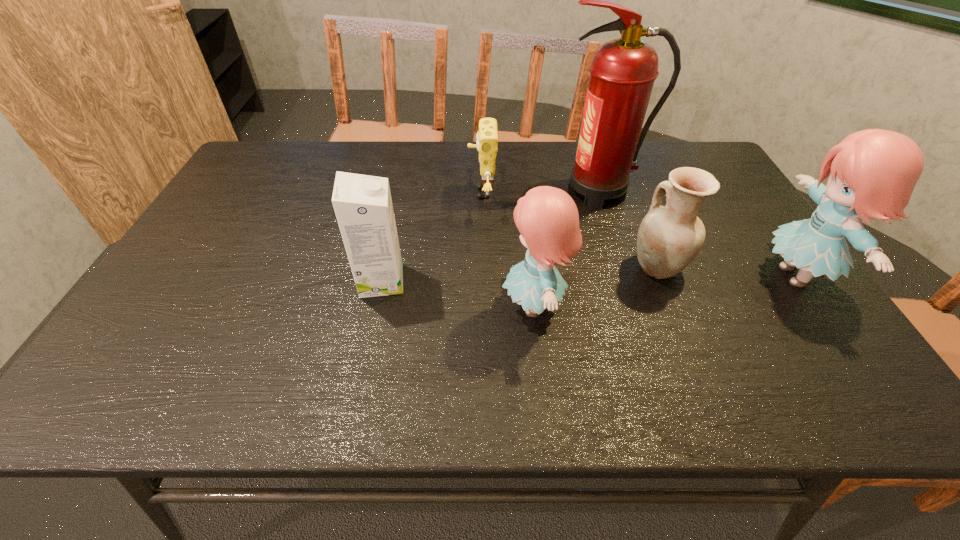
This screenshot has width=960, height=540. In order to click on empty space that is in between the pottery and the second tallest object in this screenshot , I will do `click(727, 271)`.

This screenshot has height=540, width=960. Identify the location of free space that is in between the shortest object and the left doll. (508, 249).

Locate an element on the screen. The width and height of the screenshot is (960, 540). object that is the fifth nearest to the fifth object from right to left is located at coordinates (872, 173).

Locate which object ranks in proximity to the carton. Please provide its 2D coordinates. Your answer should be formatted as a tuple, i.e. [(x, y)], where the tuple contains the x and y coordinates of a point satisfying the conditions above.

[(487, 137)]

The width and height of the screenshot is (960, 540). Identify the location of free location that satisfies the following two spatial constraints: 1. on the front-facing side of the fire extinguisher; 2. on the left side of the pottery. (625, 267).